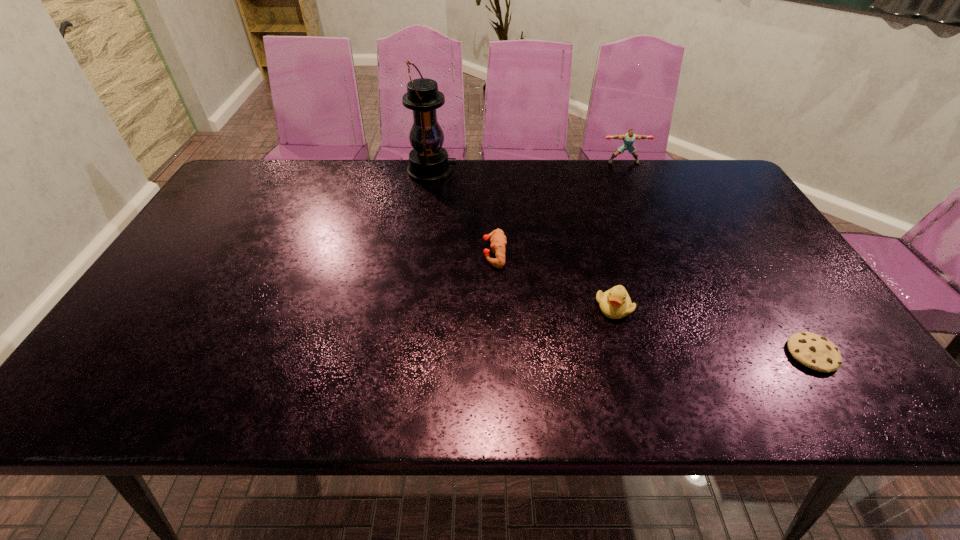
Identify a few places in the vacant region located above the lantern, indicating its light source. Please provide its 2D coordinates. Your answer should be formatted as a tuple, i.e. [(x, y)], where the tuple contains the x and y coordinates of a point satisfying the conditions above.

[(522, 171)]

Find the location of a particular element. This screenshot has height=540, width=960. free region located 0.170m on the front-facing side of the fourth shortest object is located at coordinates (637, 193).

Locate an element on the screen. This screenshot has height=540, width=960. free space located 0.120m on the beak of the fourth farthest object is located at coordinates [x=630, y=365].

This screenshot has height=540, width=960. Identify the location of vacant space located with the gloves of the shorter puncher facing forward. (401, 253).

Find the location of `free space located with the gloves of the shorter puncher facing forward`. free space located with the gloves of the shorter puncher facing forward is located at coordinates (465, 253).

Locate an element on the screen. The width and height of the screenshot is (960, 540). free space located 0.090m with the gloves of the shorter puncher facing forward is located at coordinates (449, 253).

Find the location of `vacant space situated 0.270m on the left of the shortest object`. vacant space situated 0.270m on the left of the shortest object is located at coordinates (664, 354).

Locate an element on the screen. lantern situated at the far edge is located at coordinates (428, 161).

I want to click on puncher located at the far edge, so click(628, 138).

At what (x,y) coordinates should I click in order to perform the action: click on object located at the near edge. Please return your answer as a coordinate pair (x, y). The width and height of the screenshot is (960, 540). Looking at the image, I should click on (x=814, y=351).